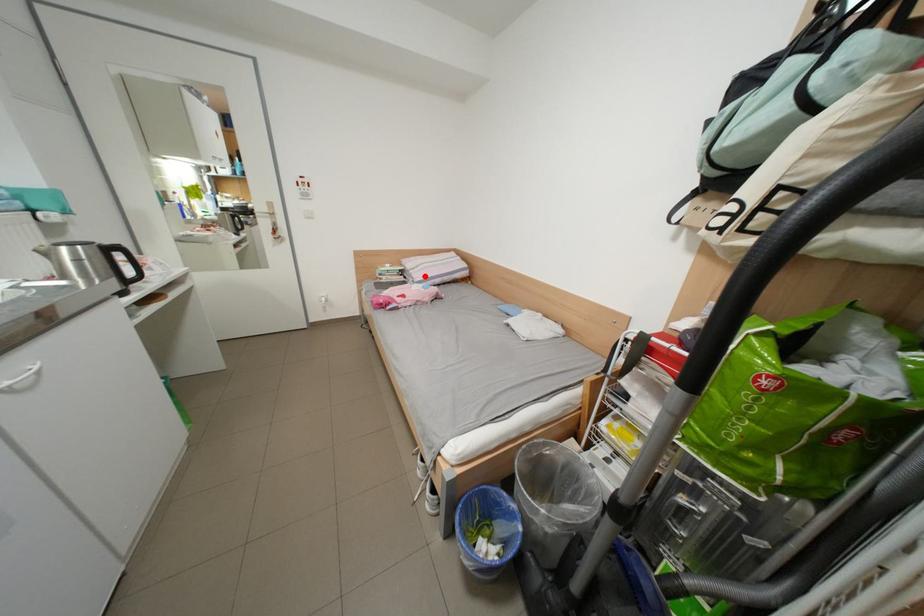
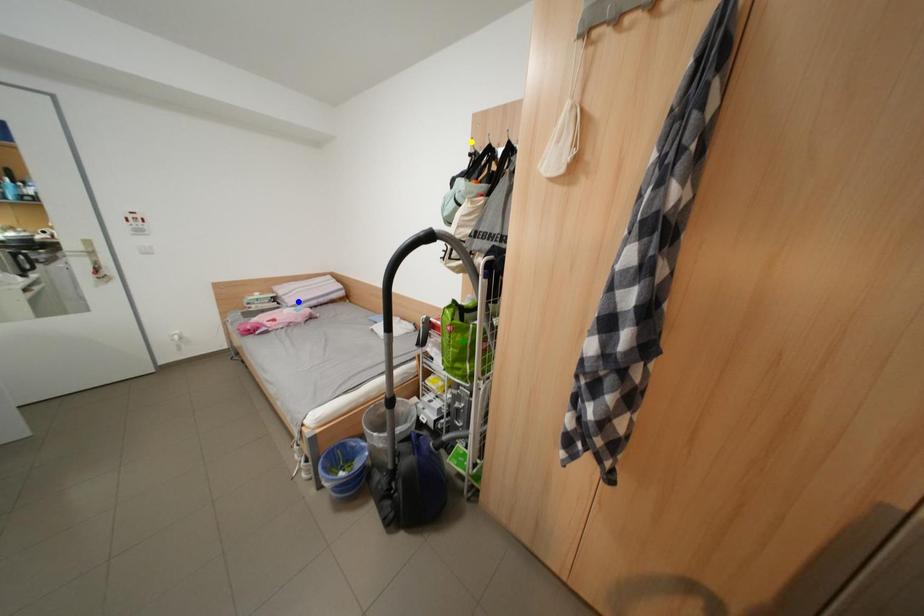
Question: I am providing you with two images of the same scene from different viewpoints. A red point is marked on the first image. You are given multiple points on the second image. Which point in image 2 is actually the same real-world point as the red point in image 1?

Choices:
 (A) yellow point
 (B) blue point
 (C) green point

Answer: (B)